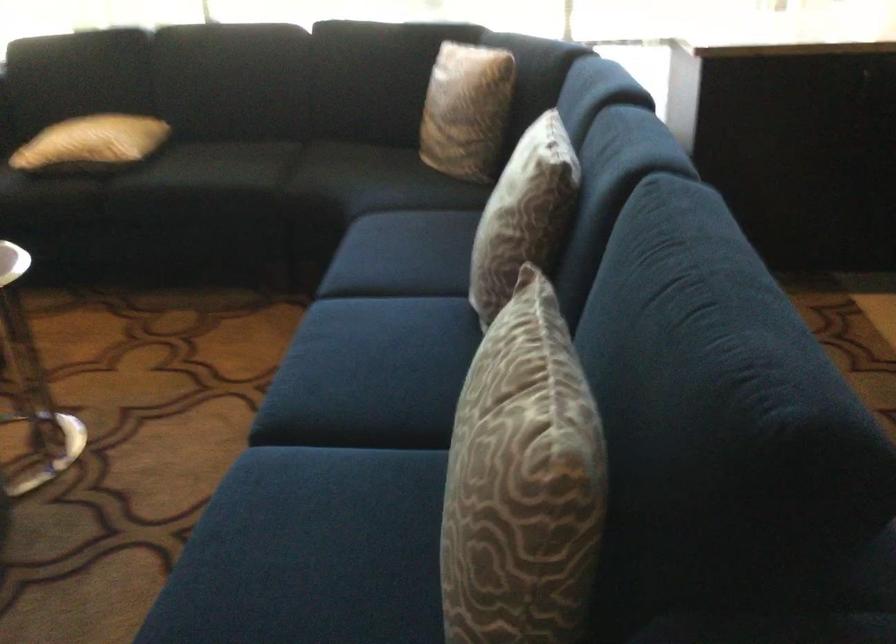
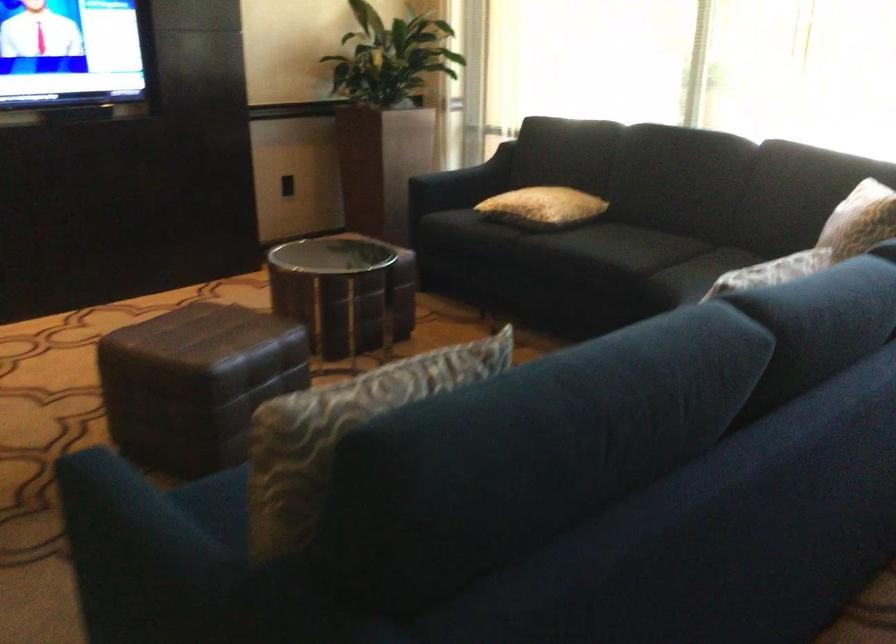
Question: How did the camera likely rotate?

Choices:
 (A) Left
 (B) Right
 (C) Up
 (D) Down

Answer: (A)